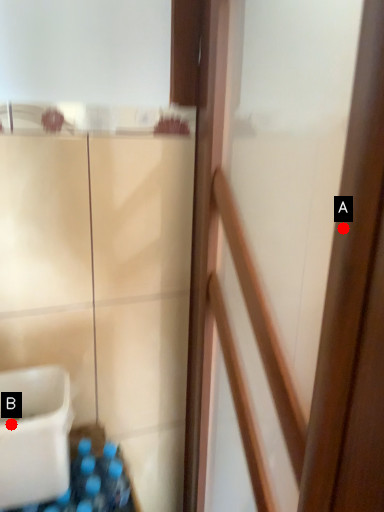
Question: Two points are circled on the image, labeled by A and B beside each circle. Which point is closer to the camera?

Choices:
 (A) A is closer
 (B) B is closer

Answer: (A)